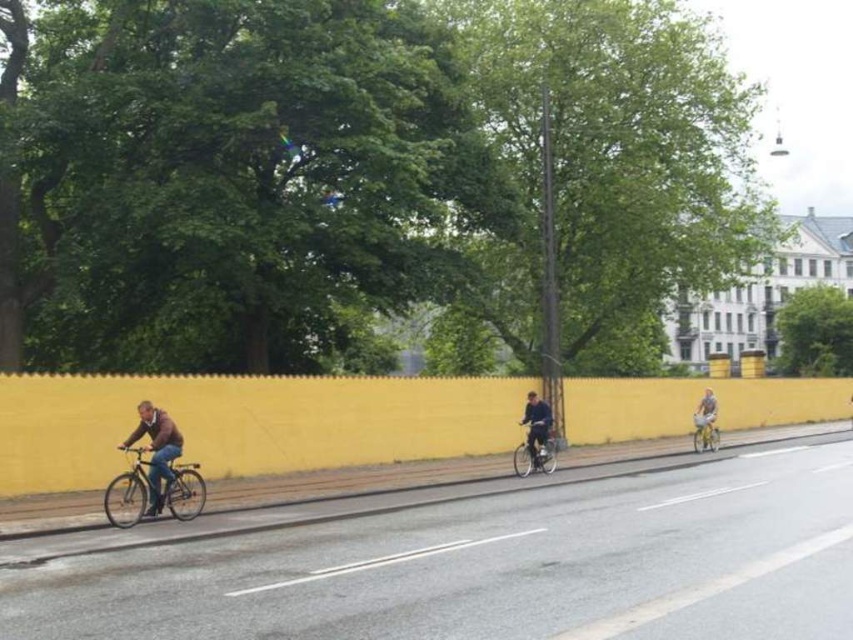
I want to click on shiny metallic bicycle at left, so click(128, 492).

The height and width of the screenshot is (640, 853). Find the location of `shiny metallic bicycle at left`. shiny metallic bicycle at left is located at coordinates (128, 492).

Where is `shiny metallic bicycle at left`? shiny metallic bicycle at left is located at coordinates (128, 492).

Is shiny silver bicycle at right smaller than black matte bicycle helmet at center?

Yes, shiny silver bicycle at right is smaller than black matte bicycle helmet at center.

Who is positioned more to the right, shiny silver bicycle at right or black matte bicycle helmet at center?

black matte bicycle helmet at center

I want to click on shiny silver bicycle at right, so click(x=704, y=432).

What do you see at coordinates (128, 492) in the screenshot? I see `shiny metallic bicycle at left` at bounding box center [128, 492].

Does shiny metallic bicycle at left lie behind shiny silver bicycle at right?

No, shiny metallic bicycle at left is in front of shiny silver bicycle at right.

Describe the element at coordinates (128, 492) in the screenshot. I see `shiny metallic bicycle at left` at that location.

Where is `shiny metallic bicycle at left`? This screenshot has height=640, width=853. shiny metallic bicycle at left is located at coordinates (128, 492).